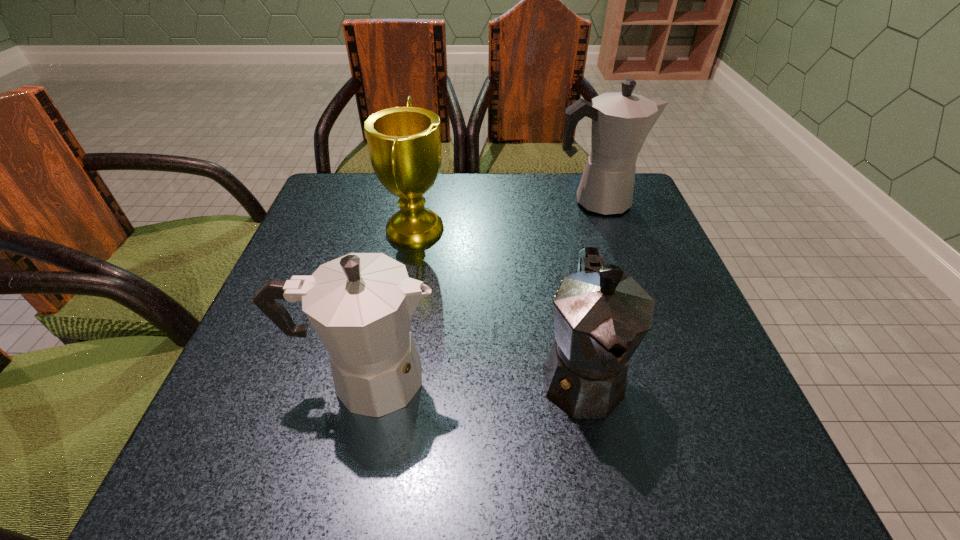
Identify the location of the farthest coffeepot. (621, 121).

Find the location of a particular element. The width and height of the screenshot is (960, 540). award is located at coordinates click(x=404, y=143).

Locate an element on the screen. The image size is (960, 540). the leftmost coffeepot is located at coordinates (360, 305).

The image size is (960, 540). In order to click on vacant space located on the left of the farthest coffeepot in this screenshot , I will do `click(426, 201)`.

Locate an element on the screen. free space located on the shiny surface of the award is located at coordinates (579, 228).

Where is `free space located 0.220m at the spout of the leftmost coffeepot`? free space located 0.220m at the spout of the leftmost coffeepot is located at coordinates (577, 379).

Where is `coffeepot at the far edge`? This screenshot has width=960, height=540. coffeepot at the far edge is located at coordinates (621, 121).

Identify the location of award located in the far edge section of the desktop. (404, 143).

Image resolution: width=960 pixels, height=540 pixels. Find the location of `object situated at the near edge`. object situated at the near edge is located at coordinates (601, 316).

Image resolution: width=960 pixels, height=540 pixels. I want to click on object that is at the left edge, so click(360, 305).